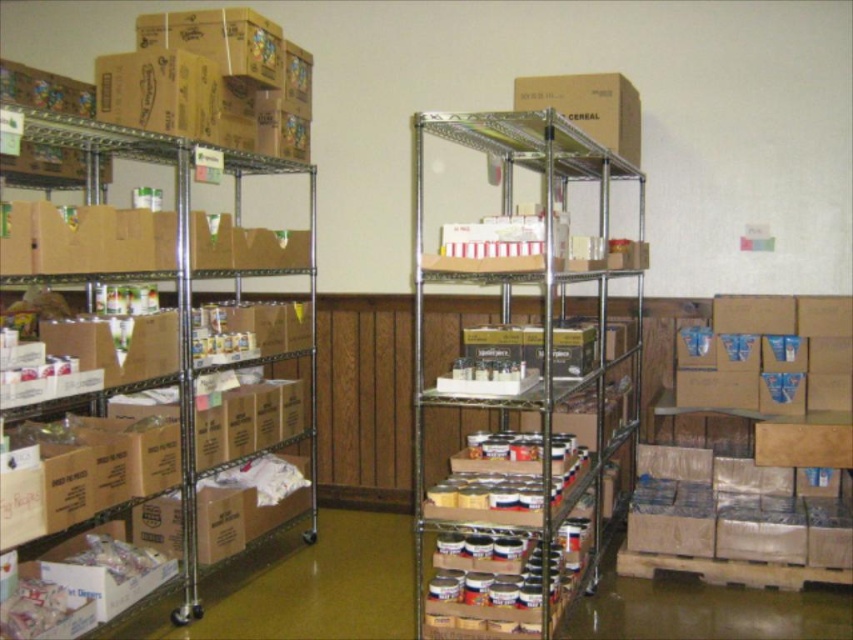
What are the coordinates of `metallic silver shelves at center` in the screenshot? It's located at (525, 388).

Is metallic silver shelves at center behind brown cardboard boxes at left?

Yes, metallic silver shelves at center is further from the viewer.

You are a GUI agent. You are given a task and a screenshot of the screen. Output one action in this format:
    pyautogui.click(x=<x>, y=<y>)
    Task: Click on the metallic silver shelves at center
    This screenshot has width=853, height=640.
    Given the screenshot: What is the action you would take?
    pyautogui.click(x=525, y=388)

Which is more to the left, brown cardboard boxes at left or cardboard box at center?

brown cardboard boxes at left is more to the left.

What do you see at coordinates (184, 280) in the screenshot?
I see `brown cardboard boxes at left` at bounding box center [184, 280].

Image resolution: width=853 pixels, height=640 pixels. I want to click on brown cardboard boxes at left, so click(184, 280).

Can you confirm if metallic silver shelves at center is taller than brown cardboard boxes at lower right?

Indeed, metallic silver shelves at center has a greater height compared to brown cardboard boxes at lower right.

Which is above, metallic silver shelves at center or brown cardboard boxes at lower right?

metallic silver shelves at center

The image size is (853, 640). Identify the location of metallic silver shelves at center. (525, 388).

I want to click on metallic silver shelves at center, so click(x=525, y=388).